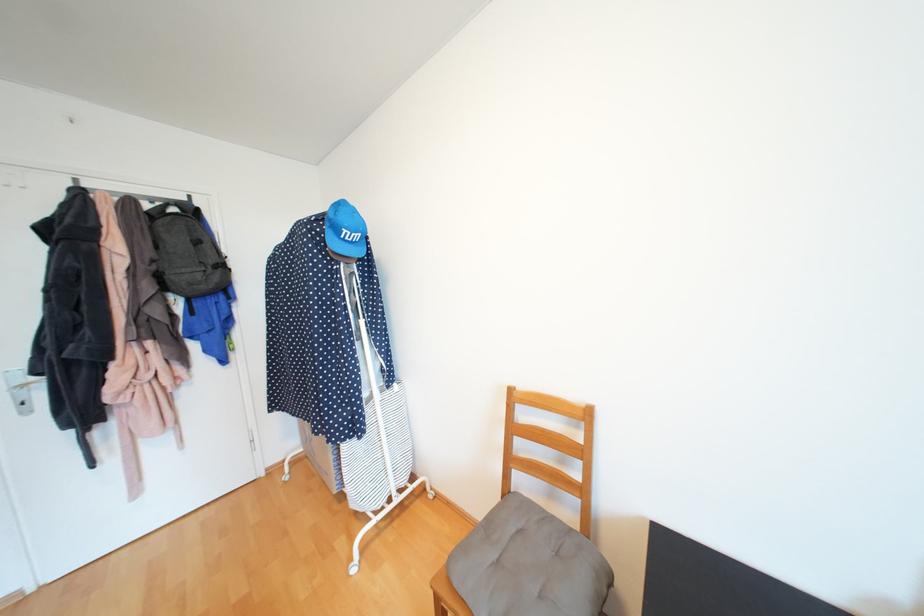
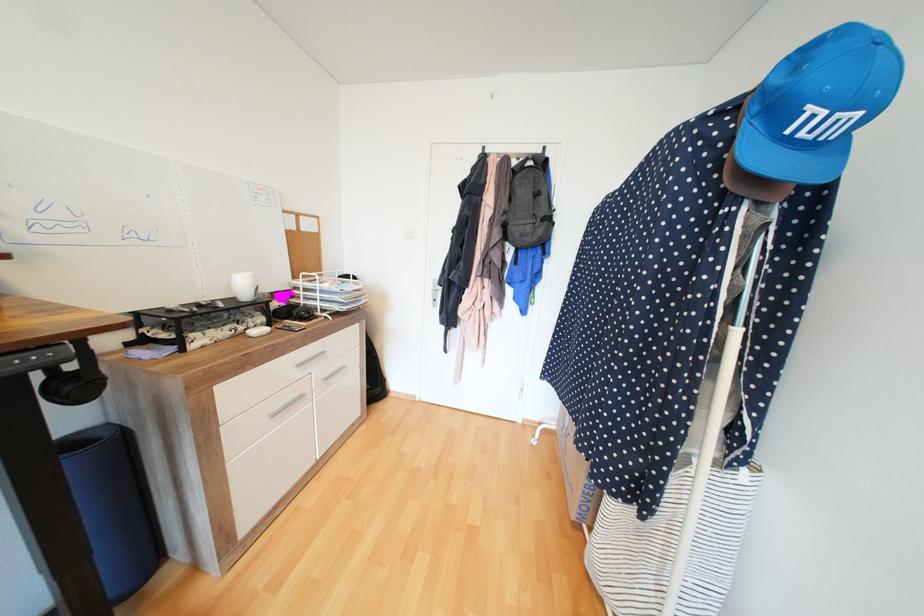
Find the pixel in the second image that matches the point at 400,385 in the first image.

(750, 471)